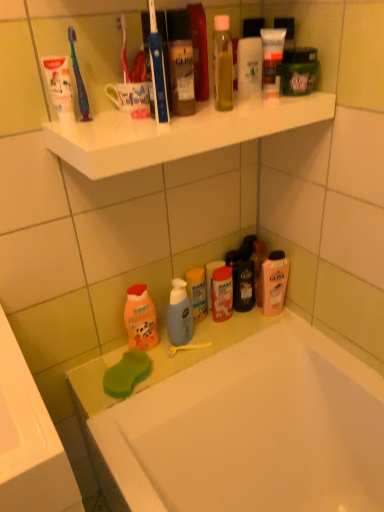
Locate an element on the screen. vacant space that is to the left of blue plastic toothbrush at upper center, which appears as the first toothbrush when viewed from the right is located at coordinates (99, 135).